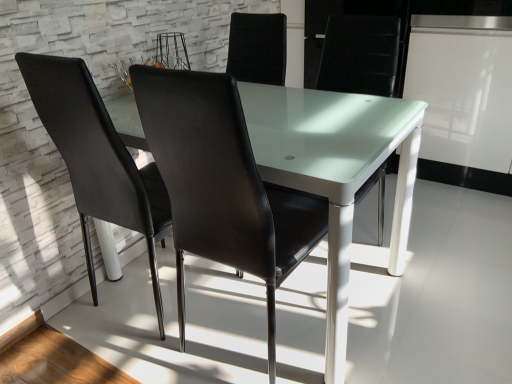
Find the location of a particular element. vacant region to the right of black leather chair at center, which appears as the 1th chair when viewed from the right is located at coordinates (412, 336).